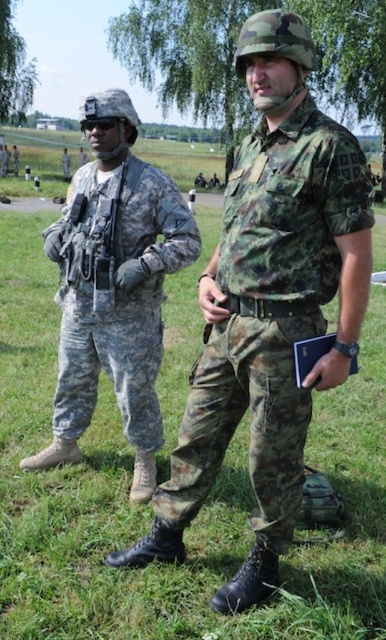
Question: Which object is closer to the camera taking this photo?

Choices:
 (A) matte black rifle at left
 (B) camouflage fabric shirt at center

Answer: (B)

Question: Is camouflage fabric shirt at center positioned in front of camouflage fabric pants at left?

Choices:
 (A) no
 (B) yes

Answer: (B)

Question: Which object is the closest to the camouflage fabric pants at left?

Choices:
 (A) camouflage fabric shirt at center
 (B) matte black rifle at left

Answer: (B)

Question: Does camouflage fabric pants at left appear over matte black rifle at left?

Choices:
 (A) yes
 (B) no

Answer: (B)

Question: Is camouflage fabric shirt at center smaller than camouflage fabric pants at left?

Choices:
 (A) yes
 (B) no

Answer: (B)

Question: Among these objects, which one is farthest from the camera?

Choices:
 (A) camouflage fabric shirt at center
 (B) matte black rifle at left

Answer: (B)